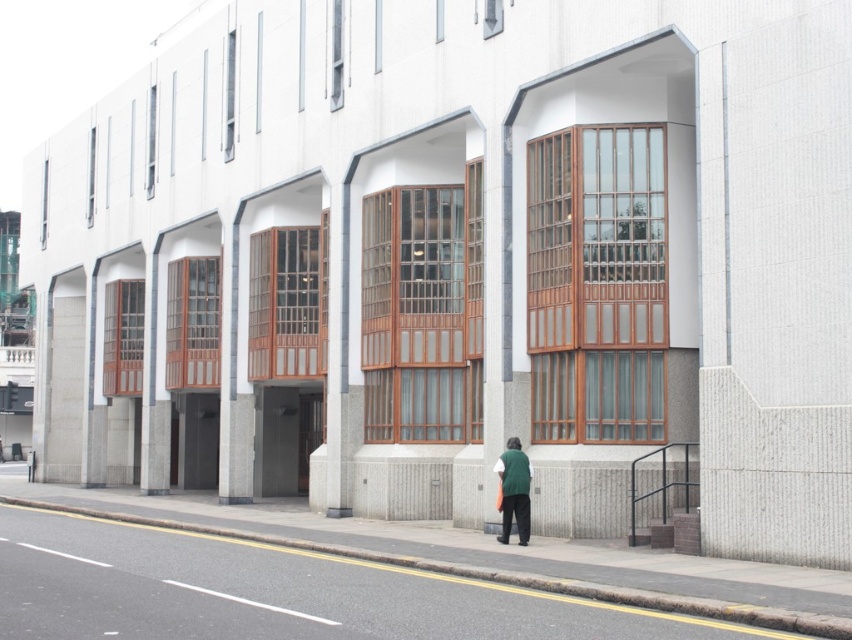
You are a delivery person standing on the sidewalk in front of the building. You need to place a heavy package on the gray concrete curb at lower left represented by point (494, 573). However, you notice that the curb is only 0.5 meters wide. Can you safely place the package there without it falling off?

The gray concrete curb at lower left represented by point (494, 573) is only 0.5 meters wide. If the package is wider than 0.5 meters, it might not fit and could fall off. Ensure the package dimensions are within the curb width before placing it.

You are a delivery person standing at the entrance of the building. You need to place a package on the gray concrete curb at lower left. Based on the coordinates provided, can you confirm the exact location where the curb is situated?

The gray concrete curb at lower left is located at coordinates point (x=494, y=573), so you can place the package there.